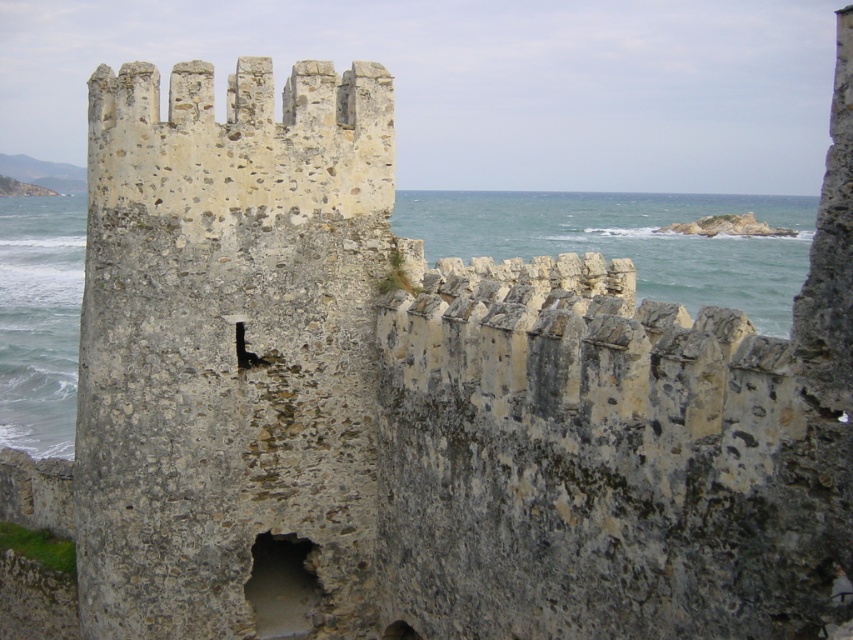
Question: Is clear water at center to the left of dark gray stone hole at center from the viewer's perspective?

Choices:
 (A) yes
 (B) no

Answer: (A)

Question: Does clear water at center lie behind dark gray stone hole at center?

Choices:
 (A) yes
 (B) no

Answer: (A)

Question: Which of the following is the farthest from the observer?

Choices:
 (A) (9, 403)
 (B) (303, 579)

Answer: (A)

Question: Does clear water at center appear over dark gray stone hole at center?

Choices:
 (A) yes
 (B) no

Answer: (A)

Question: Among these points, which one is nearest to the camera?

Choices:
 (A) (302, 628)
 (B) (65, 198)

Answer: (A)